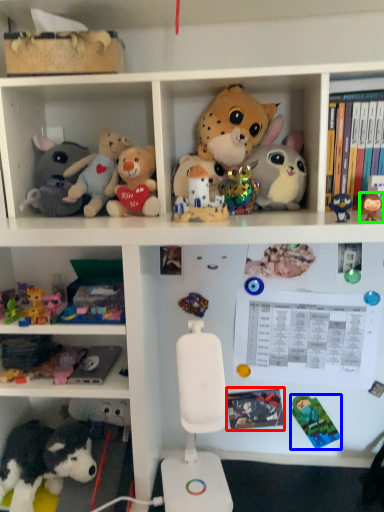
Question: Based on their relative distances, which object is nearer to book (highlighted by a red box)? Choose from toy (highlighted by a blue box) and toy (highlighted by a green box).

Choices:
 (A) toy
 (B) toy

Answer: (A)